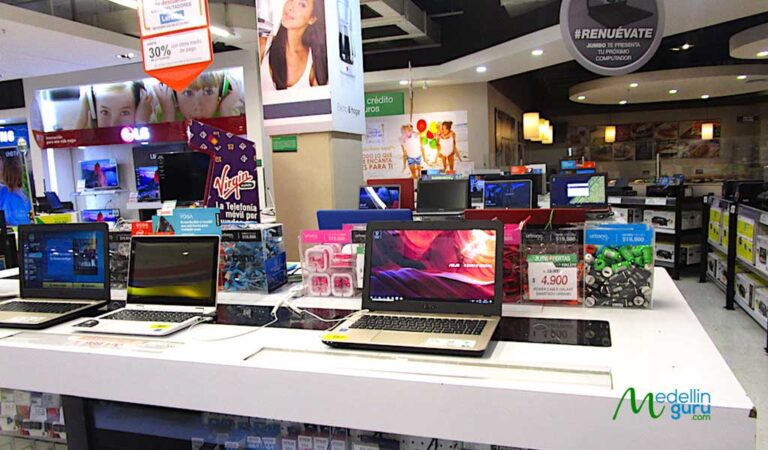
Locate an element on the screen. laptop is located at coordinates (432, 209).